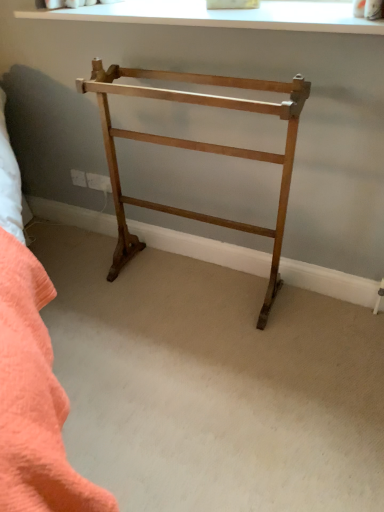
Question: Is white smooth window at upper center taller or shorter than light brown wood towel rack at center?

Choices:
 (A) short
 (B) tall

Answer: (A)

Question: In the image, is white smooth window at upper center positioned in front of or behind light brown wood towel rack at center?

Choices:
 (A) front
 (B) behind

Answer: (B)

Question: Looking at their shapes, would you say white smooth window at upper center is wider or thinner than light brown wood towel rack at center?

Choices:
 (A) wide
 (B) thin

Answer: (A)

Question: Would you say light brown wood towel rack at center is inside or outside white smooth window at upper center?

Choices:
 (A) inside
 (B) outside

Answer: (B)

Question: Is light brown wood towel rack at center bigger or smaller than white smooth window at upper center?

Choices:
 (A) big
 (B) small

Answer: (A)

Question: Is light brown wood towel rack at center wider or thinner than white smooth window at upper center?

Choices:
 (A) wide
 (B) thin

Answer: (B)

Question: Relative to white smooth window at upper center, is light brown wood towel rack at center in front or behind?

Choices:
 (A) front
 (B) behind

Answer: (A)